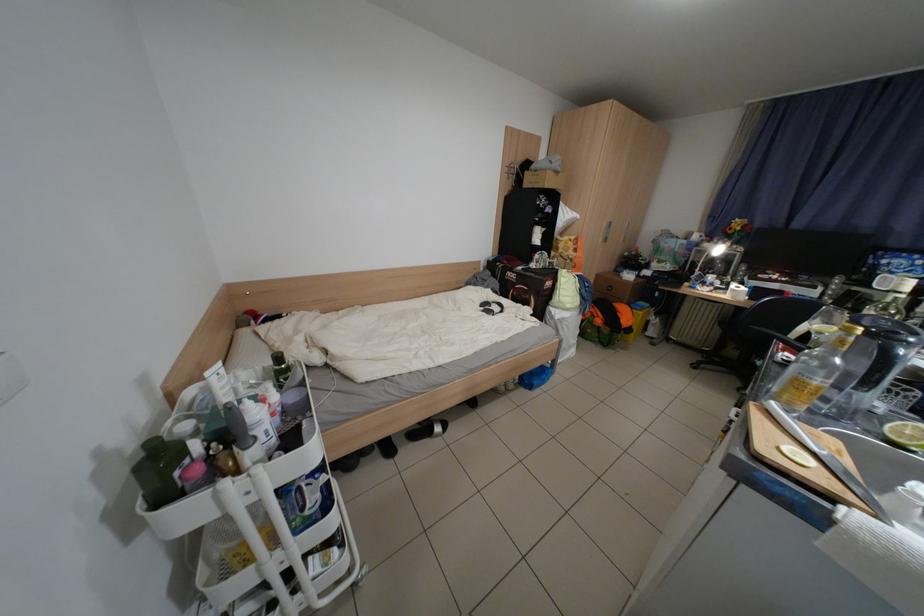
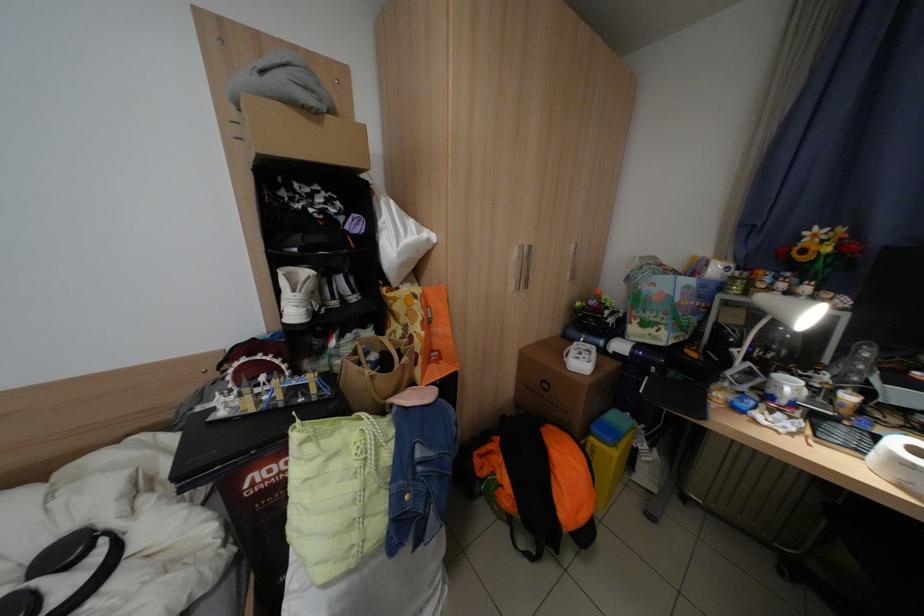
In the second image, find the point that corresponds to (x=723, y=278) in the first image.

(800, 387)